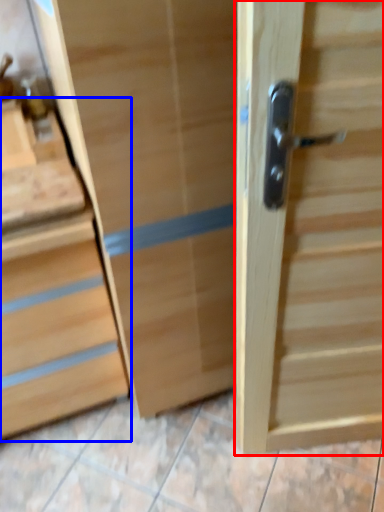
Question: Which of the following is the closest to the observer, door (highlighted by a red box) or chest of drawers (highlighted by a blue box)?

Choices:
 (A) door
 (B) chest of drawers

Answer: (A)